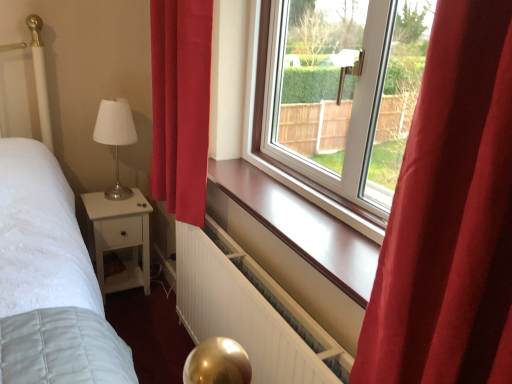
The image size is (512, 384). What do you see at coordinates (115, 137) in the screenshot?
I see `white satin table lamp at left` at bounding box center [115, 137].

Where is `white matte nightstand at lower left`? This screenshot has height=384, width=512. white matte nightstand at lower left is located at coordinates (120, 238).

The width and height of the screenshot is (512, 384). What are the coordinates of `white matte radiator at lower center` in the screenshot? It's located at (251, 311).

Is the position of white matte nightstand at lower left less distant than that of white matte radiator at lower center?

That is False.

Which is behind, point (106, 231) or point (258, 377)?

Positioned behind is point (106, 231).

Consider the image. From the image's perspective, is white matte nightstand at lower left above or below white matte radiator at lower center?

Clearly, from the image's perspective, white matte nightstand at lower left is above white matte radiator at lower center.

Is white matte nightstand at lower left oriented towards white matte radiator at lower center?

Yes, white matte nightstand at lower left is facing white matte radiator at lower center.

Consider the image. From the image's perspective, which is above, white satin table lamp at left or white matte nightstand at lower left?

From the image's view, white satin table lamp at left is above.

This screenshot has width=512, height=384. Find the location of `table lamp above the white matte nightstand at lower left (from a real-world perspective)`. table lamp above the white matte nightstand at lower left (from a real-world perspective) is located at coordinates (115, 137).

Which object is more forward, white satin table lamp at left or white matte nightstand at lower left?

Positioned in front is white satin table lamp at left.

Considering the sizes of objects red velvet curtain at left and white matte radiator at lower center in the image provided, who is smaller, red velvet curtain at left or white matte radiator at lower center?

Smaller between the two is white matte radiator at lower center.

Does point (184, 132) come closer to viewer compared to point (247, 329)?

No, (184, 132) is behind (247, 329).

From the image's perspective, does red velvet curtain at left appear lower than white matte radiator at lower center?

Incorrect, from the image's perspective, red velvet curtain at left is higher than white matte radiator at lower center.

Does point (98, 120) come farther from viewer compared to point (206, 149)?

Yes, it is behind point (206, 149).

Is white satin table lamp at left facing towards red velvet curtain at left?

Yes, white satin table lamp at left is facing red velvet curtain at left.

Does white satin table lamp at left appear on the right side of red velvet curtain at left?

No, white satin table lamp at left is not to the right of red velvet curtain at left.

Is white satin table lamp at left closer to camera compared to white matte radiator at lower center?

No, white satin table lamp at left is further to the viewer.

From a real-world perspective, which object stands above the other?

white satin table lamp at left, from a real-world perspective.

Could you tell me if white satin table lamp at left is turned towards white matte radiator at lower center?

Yes.

Find the location of a particular element. The width and height of the screenshot is (512, 384). radiator below the white satin table lamp at left (from a real-world perspective) is located at coordinates (251, 311).

Identify the location of table lamp behind the white matte radiator at lower center. The height and width of the screenshot is (384, 512). (115, 137).

Is white matte radiator at lower center placed right next to white satin table lamp at left?

There is a gap between white matte radiator at lower center and white satin table lamp at left.

Does white matte radiator at lower center have a larger size compared to white satin table lamp at left?

Correct, white matte radiator at lower center is larger in size than white satin table lamp at left.

Between white matte radiator at lower center and white satin table lamp at left, which one has larger width?

white satin table lamp at left is wider.

From a real-world perspective, which object stands above the other?

In real-world perspective, white satin table lamp at left is above.

Based on their sizes in the image, would you say white matte nightstand at lower left is bigger or smaller than white satin table lamp at left?

white matte nightstand at lower left is bigger than white satin table lamp at left.

Does white matte nightstand at lower left appear on the left side of white satin table lamp at left?

Yes, white matte nightstand at lower left is to the left of white satin table lamp at left.

Is white matte nightstand at lower left completely or partially outside of white satin table lamp at left?

Yes, white matte nightstand at lower left is outside of white satin table lamp at left.

In order to click on radiator above the white matte nightstand at lower left (from a real-world perspective) in this screenshot , I will do `click(251, 311)`.

At what (x,y) coordinates should I click in order to perform the action: click on nightstand that is under the white satin table lamp at left (from a real-world perspective). Please return your answer as a coordinate pair (x, y). This screenshot has height=384, width=512. Looking at the image, I should click on (120, 238).

Estimate the real-world distances between objects in this image. Which object is further from white matte radiator at lower center, white satin table lamp at left or white matte nightstand at lower left?

Based on the image, white satin table lamp at left appears to be further to white matte radiator at lower center.

Which object lies further to the anchor point white matte radiator at lower center, red velvet curtain at left or white satin table lamp at left?

white satin table lamp at left.

Considering their positions, is white satin table lamp at left positioned further to white matte radiator at lower center than red velvet curtain at left?

white satin table lamp at left is positioned further to the anchor white matte radiator at lower center.

Looking at the image, which one is located closer to white satin table lamp at left, white matte nightstand at lower left or red velvet curtain at left?

Among the two, white matte nightstand at lower left is located nearer to white satin table lamp at left.

Looking at the image, which one is located closer to red velvet curtain at left, white satin table lamp at left or white matte nightstand at lower left?

Among the two, white satin table lamp at left is located nearer to red velvet curtain at left.

Based on the photo, which object lies nearer to the anchor point red velvet curtain at left, white matte nightstand at lower left or white matte radiator at lower center?

white matte radiator at lower center is closer to red velvet curtain at left.

Which object lies nearer to the anchor point white satin table lamp at left, white matte radiator at lower center or red velvet curtain at left?

red velvet curtain at left lies closer to white satin table lamp at left than the other object.

From the image, which object appears to be farther from white matte nightstand at lower left, white matte radiator at lower center or red velvet curtain at left?

Based on the image, white matte radiator at lower center appears to be further to white matte nightstand at lower left.

The height and width of the screenshot is (384, 512). In order to click on curtain located between white matte radiator at lower center and white satin table lamp at left in the depth direction in this screenshot , I will do `click(181, 105)`.

Locate an element on the screen. The image size is (512, 384). curtain between white matte radiator at lower center and white matte nightstand at lower left in the front-back direction is located at coordinates (181, 105).

Locate an element on the screen. table lamp between white matte radiator at lower center and white matte nightstand at lower left in the front-back direction is located at coordinates (115, 137).

Identify the location of table lamp between red velvet curtain at left and white matte nightstand at lower left along the z-axis. This screenshot has height=384, width=512. (115, 137).